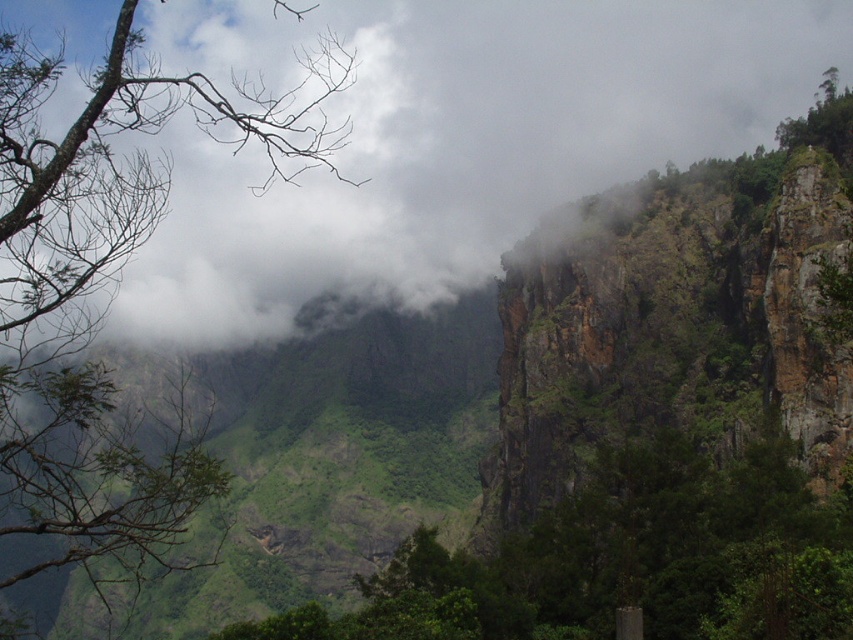
Question: Which of the following is the closest to the observer?

Choices:
 (A) (430, 557)
 (B) (41, 77)

Answer: (B)

Question: Where is white fluffy cloud at upper left located in relation to green leafy tree at center in the image?

Choices:
 (A) right
 (B) left

Answer: (B)

Question: Is green leafy tree at upper left positioned behind green leafy tree at center?

Choices:
 (A) yes
 (B) no

Answer: (B)

Question: Estimate the real-world distances between objects in this image. Which object is closer to the green leafy tree at center?

Choices:
 (A) green leafy tree at upper left
 (B) white fluffy cloud at upper left

Answer: (A)

Question: Does white fluffy cloud at upper left appear over green leafy tree at center?

Choices:
 (A) no
 (B) yes

Answer: (B)

Question: Considering the real-world distances, which object is closest to the white fluffy cloud at upper left?

Choices:
 (A) green leafy tree at upper left
 (B) green leafy tree at center

Answer: (A)